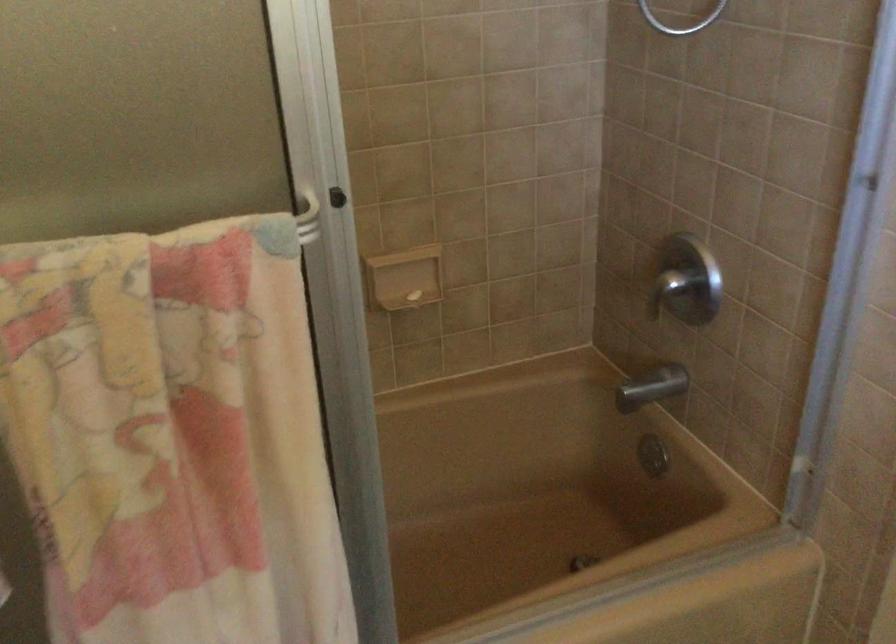
Based on the photo, the first image is from the beginning of the video and the second image is from the end. How did the camera likely rotate when shooting the video?

The camera's rotation is toward left-down.